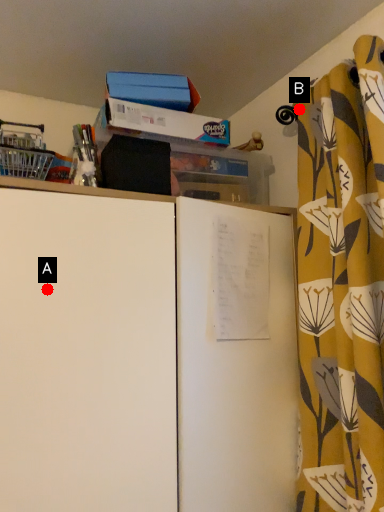
Question: Two points are circled on the image, labeled by A and B beside each circle. Which point is farther to the camera?

Choices:
 (A) A is further
 (B) B is further

Answer: (B)